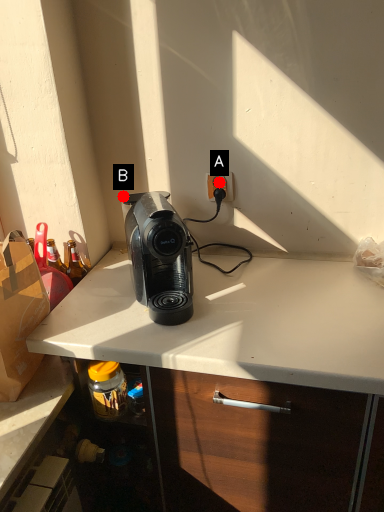
Question: Two points are circled on the image, labeled by A and B beside each circle. Which point is closer to the camera?

Choices:
 (A) A is closer
 (B) B is closer

Answer: (B)